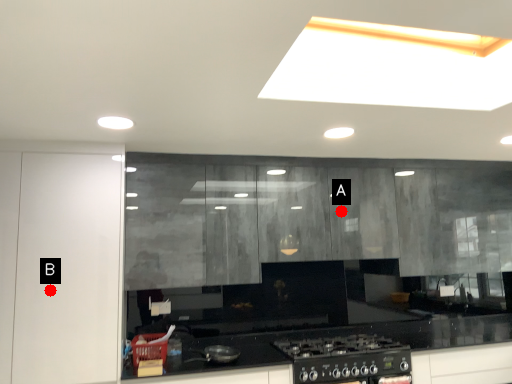
Question: Two points are circled on the image, labeled by A and B beside each circle. Among these points, which one is nearest to the camera?

Choices:
 (A) A is closer
 (B) B is closer

Answer: (B)